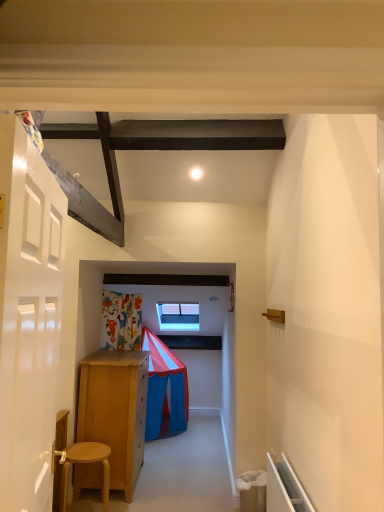
Question: From the image's perspective, does white glossy door at left appear higher than light brown wooden stool at lower left?

Choices:
 (A) yes
 (B) no

Answer: (A)

Question: Considering the relative sizes of white glossy door at left and light brown wooden stool at lower left in the image provided, is white glossy door at left bigger than light brown wooden stool at lower left?

Choices:
 (A) no
 (B) yes

Answer: (B)

Question: Is white glossy door at left with light brown wooden stool at lower left?

Choices:
 (A) yes
 (B) no

Answer: (B)

Question: Is white glossy door at left not close to light brown wooden stool at lower left?

Choices:
 (A) no
 (B) yes

Answer: (B)

Question: Is white glossy door at left turned away from light brown wooden stool at lower left?

Choices:
 (A) no
 (B) yes

Answer: (A)

Question: From a real-world perspective, is white glossy door at left beneath light brown wooden stool at lower left?

Choices:
 (A) yes
 (B) no

Answer: (B)

Question: Are light brown wooden stool at lower left and white glossy door at left far apart?

Choices:
 (A) no
 (B) yes

Answer: (B)

Question: Can you confirm if light brown wooden stool at lower left is shorter than white glossy door at left?

Choices:
 (A) yes
 (B) no

Answer: (A)

Question: Is light brown wooden stool at lower left surrounding white glossy door at left?

Choices:
 (A) no
 (B) yes

Answer: (A)

Question: Does light brown wooden stool at lower left have a smaller size compared to white glossy door at left?

Choices:
 (A) no
 (B) yes

Answer: (B)

Question: Is light brown wooden stool at lower left placed right next to white glossy door at left?

Choices:
 (A) yes
 (B) no

Answer: (B)

Question: Is light brown wooden stool at lower left turned away from white glossy door at left?

Choices:
 (A) yes
 (B) no

Answer: (B)

Question: Is light brown wooden stool at lower left bigger or smaller than white glossy door at left?

Choices:
 (A) small
 (B) big

Answer: (A)